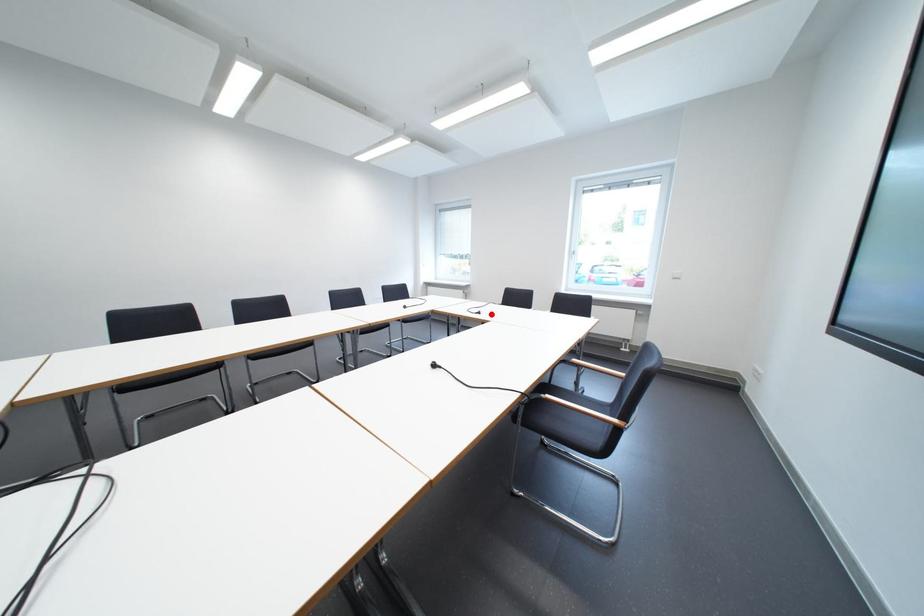
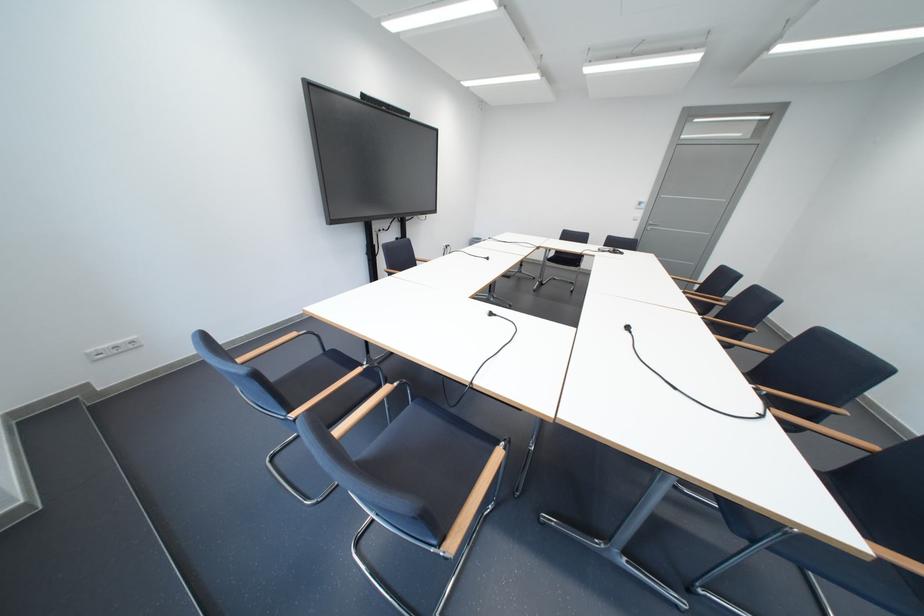
Find the pixel in the second image that matches the highlighted location in the first image.

(503, 315)